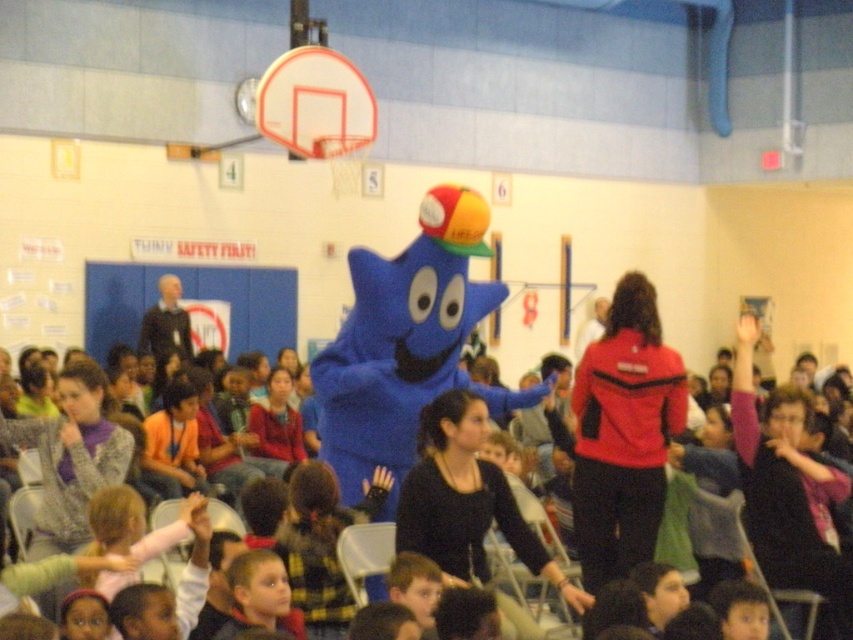
Question: Is blue plush mascot at center above yellow rubber basketball at center?

Choices:
 (A) no
 (B) yes

Answer: (A)

Question: Does blue plush mascot at center have a smaller size compared to yellow rubber basketball at center?

Choices:
 (A) no
 (B) yes

Answer: (A)

Question: Which of the following is the closest to the observer?

Choices:
 (A) yellow rubber basketball at center
 (B) blue plush mascot at center

Answer: (B)

Question: Which of the following is the farthest from the observer?

Choices:
 (A) (358, 323)
 (B) (468, 250)

Answer: (A)

Question: Is blue plush mascot at center above yellow rubber basketball at center?

Choices:
 (A) no
 (B) yes

Answer: (A)